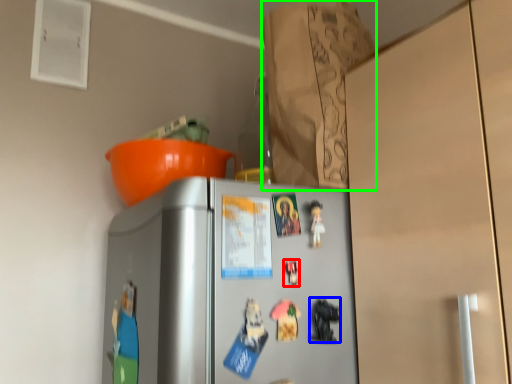
Question: Which object is the farthest from toy (highlighted by a red box)? Choose among these: toy (highlighted by a blue box) or paper bag (highlighted by a green box).

Choices:
 (A) toy
 (B) paper bag

Answer: (B)